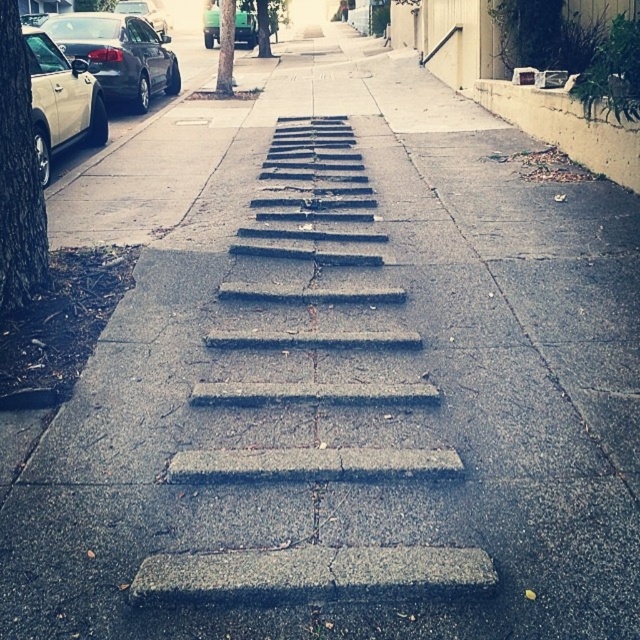
Does green leafy tree at left come behind matte silver car at left?

That is False.

Does green leafy tree at left have a lesser width compared to matte silver car at left?

Yes.

You are a GUI agent. You are given a task and a screenshot of the screen. Output one action in this format:
    pyautogui.click(x=<x>, y=<y>)
    Task: Click on the green leafy tree at left
    
    Given the screenshot: What is the action you would take?
    pyautogui.click(x=19, y=173)

Find the location of a particular element. This screenshot has width=640, height=640. green leafy tree at left is located at coordinates (19, 173).

Can you confirm if gray concrete steps at center is taller than green rough bark tree at center?

No.

Can you confirm if gray concrete steps at center is wider than green rough bark tree at center?

In fact, gray concrete steps at center might be narrower than green rough bark tree at center.

Does point (412, 372) lie behind point (221, 1)?

No, (412, 372) is in front of (221, 1).

This screenshot has height=640, width=640. Identify the location of gray concrete steps at center. (314, 385).

Who is higher up, green matte truck at upper center or shiny black sedan at upper left?

shiny black sedan at upper left

Can you confirm if green matte truck at upper center is positioned to the right of shiny black sedan at upper left?

Indeed, green matte truck at upper center is positioned on the right side of shiny black sedan at upper left.

Is point (205, 29) farther from viewer compared to point (118, 1)?

No, (205, 29) is in front of (118, 1).

I want to click on green matte truck at upper center, so click(x=244, y=28).